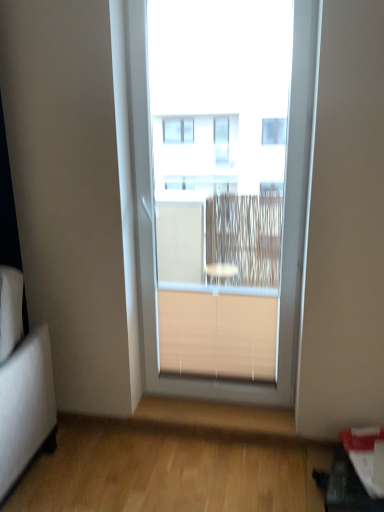
Measure the distance between point (232, 12) and camera.

4.12 meters.

Locate an element on the screen. The image size is (384, 512). transparent glass window at center is located at coordinates (222, 189).

Describe the element at coordinates (222, 189) in the screenshot. I see `transparent glass window at center` at that location.

In order to click on transparent glass window at center in this screenshot , I will do `click(222, 189)`.